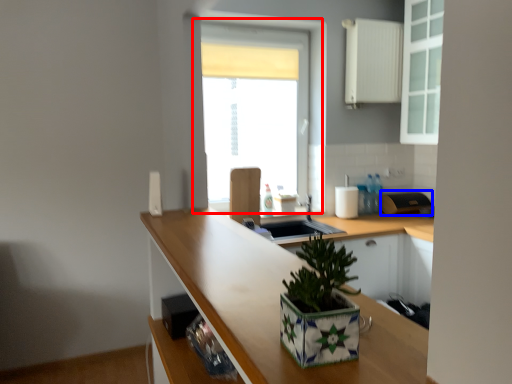
Question: Which of the following is the closest to the observer, window (highlighted by a red box) or appliance (highlighted by a blue box)?

Choices:
 (A) window
 (B) appliance

Answer: (A)